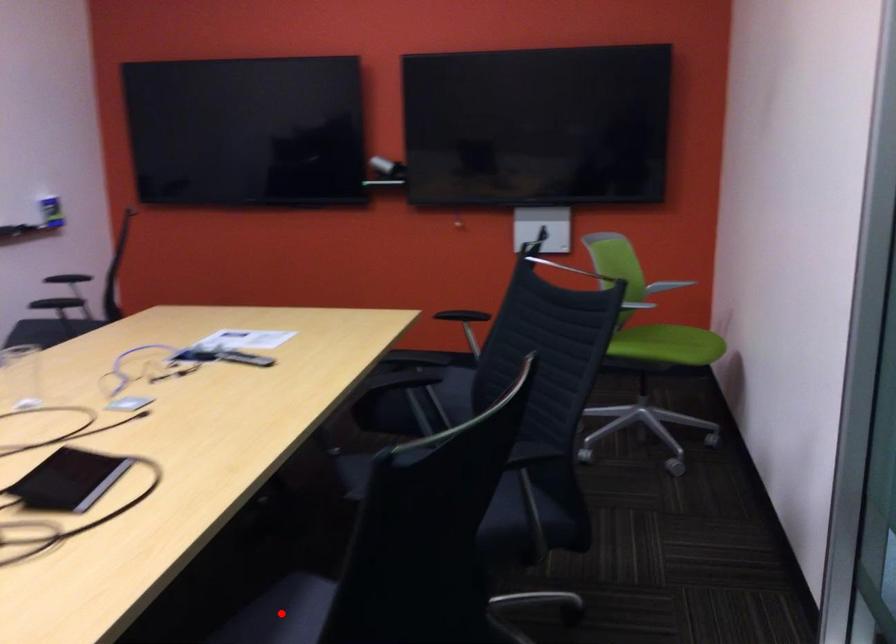
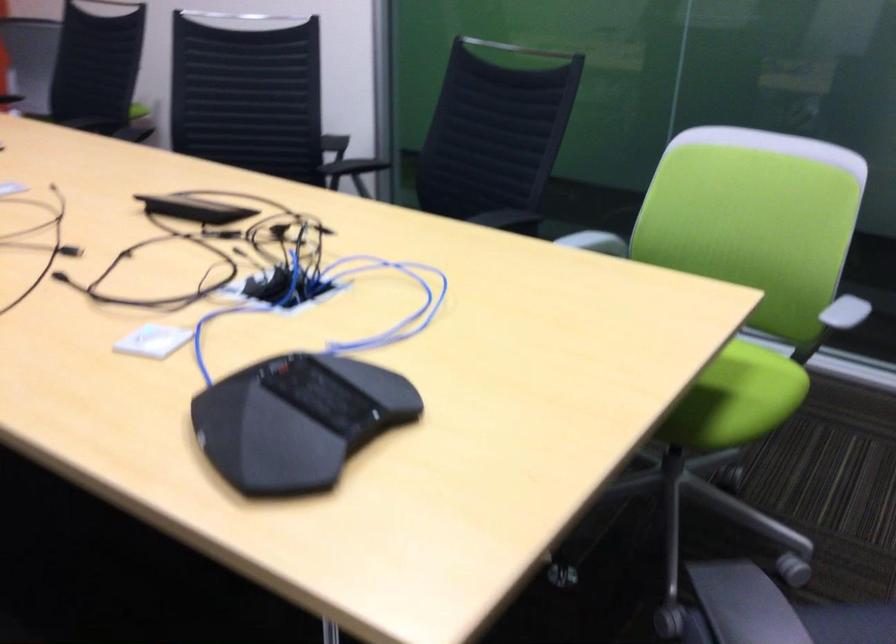
Question: I am providing you with two images of the same scene from different viewpoints. A red point is marked on the first image. Is the red point's position out of view in image 2?

Choices:
 (A) Yes
 (B) No

Answer: (A)